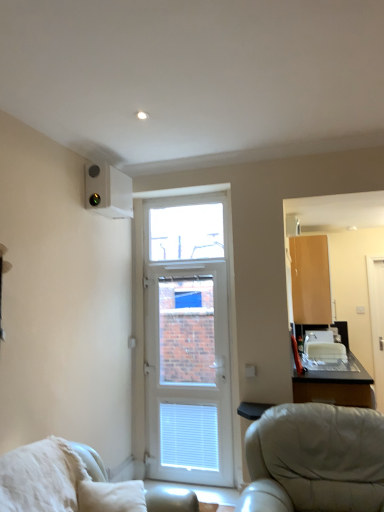
Question: Is matte wood cabinet at upper right smaller than white plastic air conditioning unit at upper left?

Choices:
 (A) no
 (B) yes

Answer: (A)

Question: Is white plastic air conditioning unit at upper left located within matte wood cabinet at upper right?

Choices:
 (A) no
 (B) yes

Answer: (A)

Question: From a real-world perspective, is matte wood cabinet at upper right on white plastic air conditioning unit at upper left?

Choices:
 (A) yes
 (B) no

Answer: (B)

Question: Considering the relative sizes of matte wood cabinet at upper right and white plastic air conditioning unit at upper left in the image provided, is matte wood cabinet at upper right taller than white plastic air conditioning unit at upper left?

Choices:
 (A) yes
 (B) no

Answer: (A)

Question: Is matte wood cabinet at upper right located outside white plastic air conditioning unit at upper left?

Choices:
 (A) yes
 (B) no

Answer: (A)

Question: Is matte wood cabinet at upper right aimed at white plastic air conditioning unit at upper left?

Choices:
 (A) no
 (B) yes

Answer: (A)

Question: Is white fluffy pillow at lower left directly adjacent to transparent glass window at center?

Choices:
 (A) no
 (B) yes

Answer: (A)

Question: Does white fluffy pillow at lower left have a smaller size compared to transparent glass window at center?

Choices:
 (A) yes
 (B) no

Answer: (B)

Question: Is white fluffy pillow at lower left taller than transparent glass window at center?

Choices:
 (A) no
 (B) yes

Answer: (A)

Question: From a real-world perspective, is white fluffy pillow at lower left physically above transparent glass window at center?

Choices:
 (A) no
 (B) yes

Answer: (A)

Question: Is white fluffy pillow at lower left positioned with its back to transparent glass window at center?

Choices:
 (A) yes
 (B) no

Answer: (B)

Question: Does white fluffy pillow at lower left have a lesser height compared to transparent glass window at center?

Choices:
 (A) no
 (B) yes

Answer: (B)

Question: Is white plastic door at center wider than white glossy screen door at right?

Choices:
 (A) yes
 (B) no

Answer: (A)